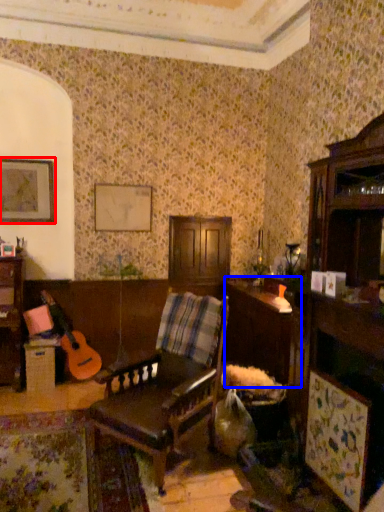
Question: Which point is closer to the camera, picture frame (highlighted by a red box) or table (highlighted by a blue box)?

Choices:
 (A) picture frame
 (B) table

Answer: (B)